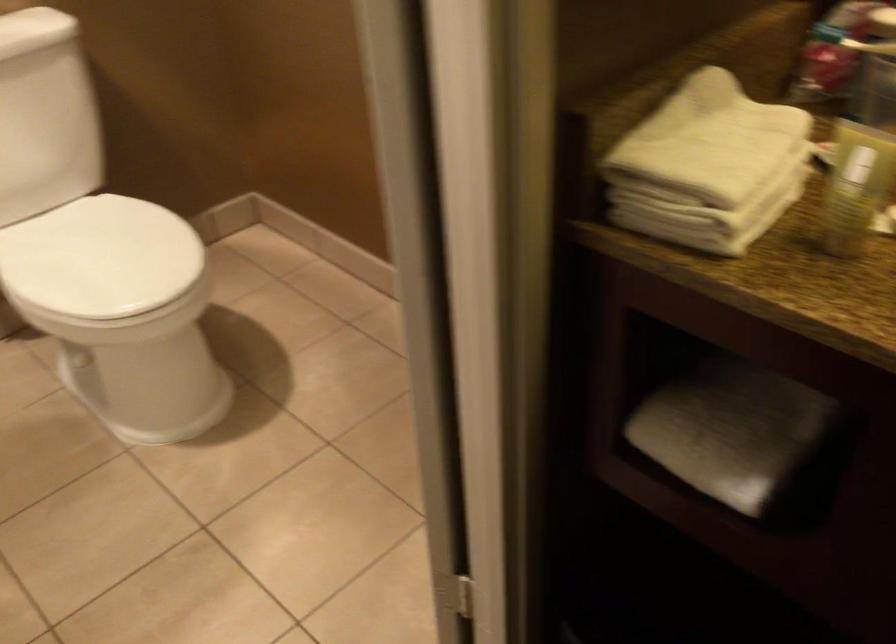
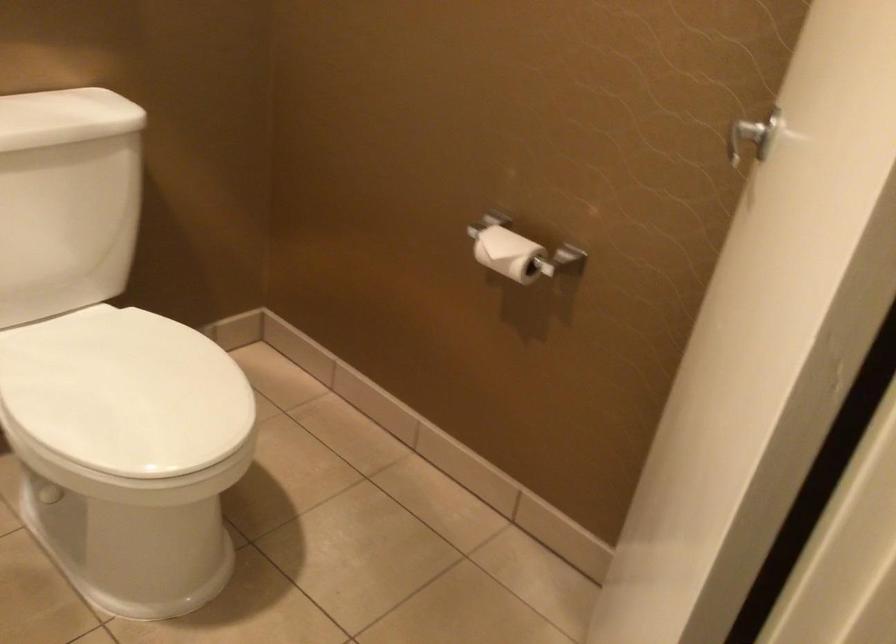
Find the pixel in the second image that matches point 95,259 in the first image.

(125, 393)